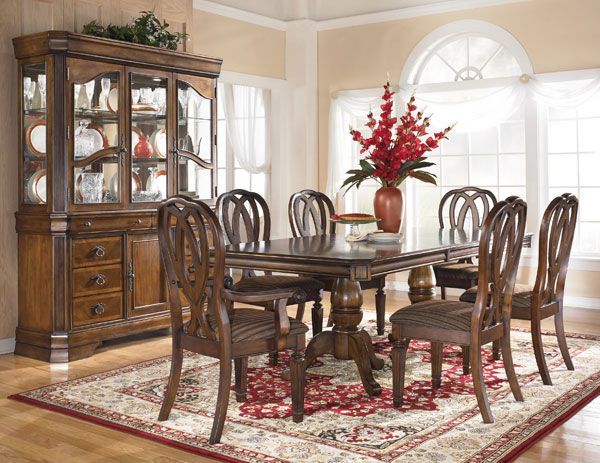
Find the location of `wooden chair`. wooden chair is located at coordinates (448, 336), (549, 310), (460, 267), (261, 289), (381, 292), (219, 325).